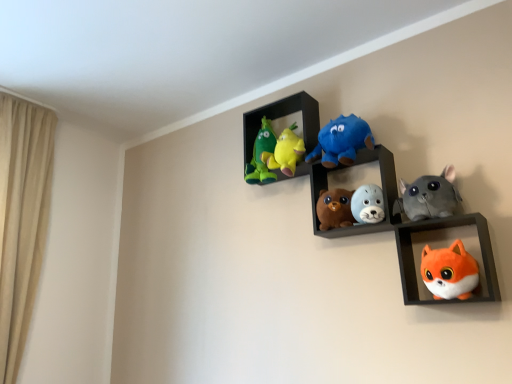
Identify the location of free space above beige fabric curtain at left (from a real-world perspective). (35, 102).